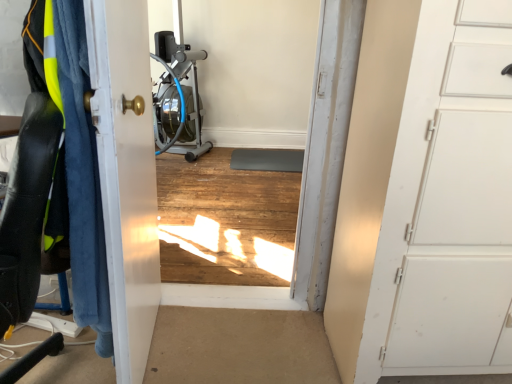
Question: Can we say blue fuzzy blanket at left lies outside metallic silver rowing machine at center?

Choices:
 (A) yes
 (B) no

Answer: (A)

Question: Is blue fuzzy blanket at left taller than metallic silver rowing machine at center?

Choices:
 (A) yes
 (B) no

Answer: (B)

Question: Could metallic silver rowing machine at center be considered to be inside blue fuzzy blanket at left?

Choices:
 (A) no
 (B) yes

Answer: (A)

Question: Considering the relative positions of blue fuzzy blanket at left and metallic silver rowing machine at center in the image provided, is blue fuzzy blanket at left in front of metallic silver rowing machine at center?

Choices:
 (A) yes
 (B) no

Answer: (A)

Question: Is blue fuzzy blanket at left further to the viewer compared to metallic silver rowing machine at center?

Choices:
 (A) yes
 (B) no

Answer: (B)

Question: Is blue fuzzy blanket at left smaller than metallic silver rowing machine at center?

Choices:
 (A) yes
 (B) no

Answer: (A)

Question: Can you confirm if metallic silver rowing machine at center is wider than blue fuzzy blanket at left?

Choices:
 (A) no
 (B) yes

Answer: (B)

Question: Is metallic silver rowing machine at center oriented away from blue fuzzy blanket at left?

Choices:
 (A) yes
 (B) no

Answer: (B)

Question: Would you say blue fuzzy blanket at left is part of metallic silver rowing machine at center's contents?

Choices:
 (A) no
 (B) yes

Answer: (A)

Question: From a real-world perspective, is metallic silver rowing machine at center physically below blue fuzzy blanket at left?

Choices:
 (A) yes
 (B) no

Answer: (A)

Question: Considering the relative sizes of metallic silver rowing machine at center and blue fuzzy blanket at left in the image provided, is metallic silver rowing machine at center shorter than blue fuzzy blanket at left?

Choices:
 (A) yes
 (B) no

Answer: (B)

Question: Is metallic silver rowing machine at center positioned behind blue fuzzy blanket at left?

Choices:
 (A) no
 (B) yes

Answer: (B)

Question: From the image's perspective, is blue fuzzy blanket at left under matte black swivel chair at left?

Choices:
 (A) no
 (B) yes

Answer: (A)